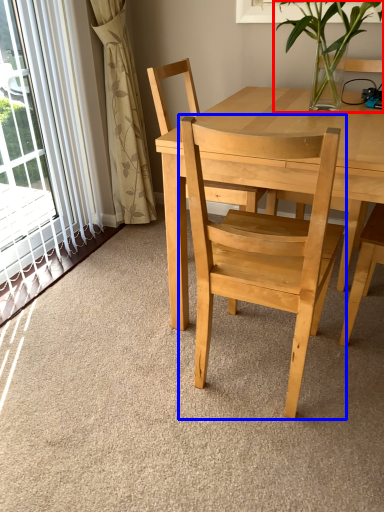
Question: Which object appears closest to the camera in this image, houseplant (highlighted by a red box) or chair (highlighted by a blue box)?

Choices:
 (A) houseplant
 (B) chair

Answer: (B)